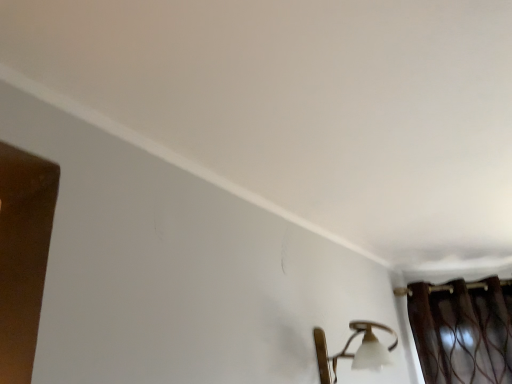
Question: Should I look upward or downward to see matte gold wall sconce at lower right?

Choices:
 (A) up
 (B) down

Answer: (B)